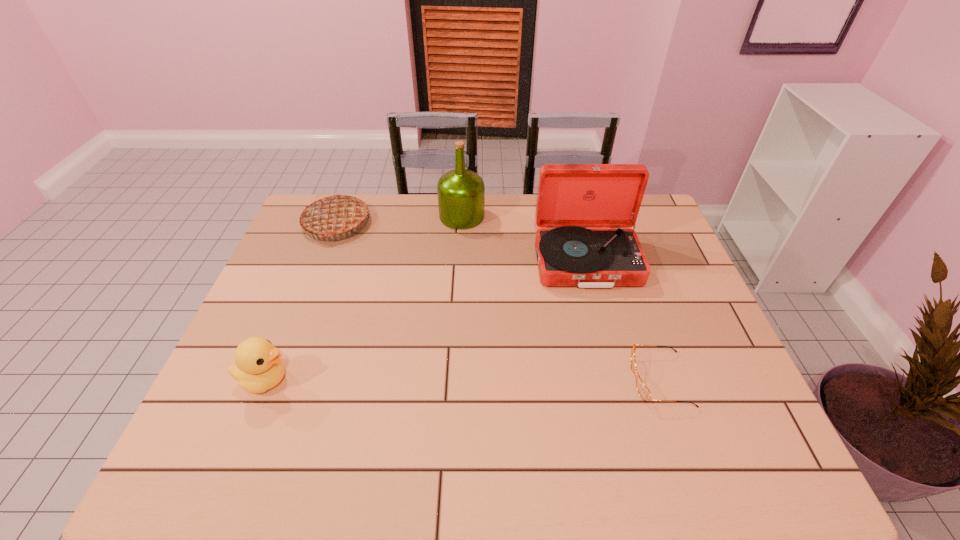
This screenshot has height=540, width=960. Identify the location of vacant region located 0.080m on the front-facing side of the shortest object. (599, 380).

Locate an element on the screen. This screenshot has height=540, width=960. vacant space located 0.170m on the front-facing side of the shortest object is located at coordinates (561, 380).

Locate an element on the screen. The height and width of the screenshot is (540, 960). olive oil situated at the far edge is located at coordinates (461, 193).

At what (x,y) coordinates should I click in order to perform the action: click on pie that is positioned at the far edge. Please return your answer as a coordinate pair (x, y). This screenshot has height=540, width=960. Looking at the image, I should click on pyautogui.click(x=335, y=214).

At what (x,y) coordinates should I click in order to perform the action: click on pie at the left edge. Please return your answer as a coordinate pair (x, y). Looking at the image, I should click on (335, 214).

This screenshot has height=540, width=960. Find the location of `duck at the left edge`. duck at the left edge is located at coordinates (258, 367).

Identify the location of phonograph_record positioned at the right edge. (584, 211).

At what (x,y) coordinates should I click in order to perform the action: click on spectacles that is at the right edge. Please return your answer as a coordinate pair (x, y). This screenshot has width=960, height=540. Looking at the image, I should click on pyautogui.click(x=644, y=392).

Find the location of a particular element. The image size is (960, 540). object that is at the far left corner is located at coordinates (335, 214).

The image size is (960, 540). I want to click on free space at the far edge of the desktop, so click(403, 236).